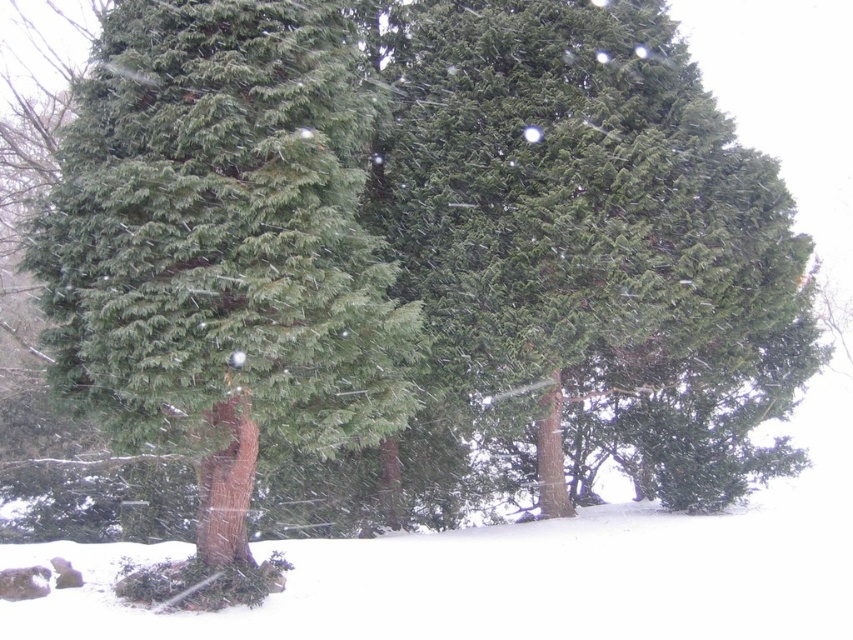
Who is positioned more to the right, green needle-like at center or green matte fir tree at center?

From the viewer's perspective, green needle-like at center appears more on the right side.

Does green needle-like at center have a larger size compared to green matte fir tree at center?

Incorrect, green needle-like at center is not larger than green matte fir tree at center.

Locate an element on the screen. green needle-like at center is located at coordinates (590, 225).